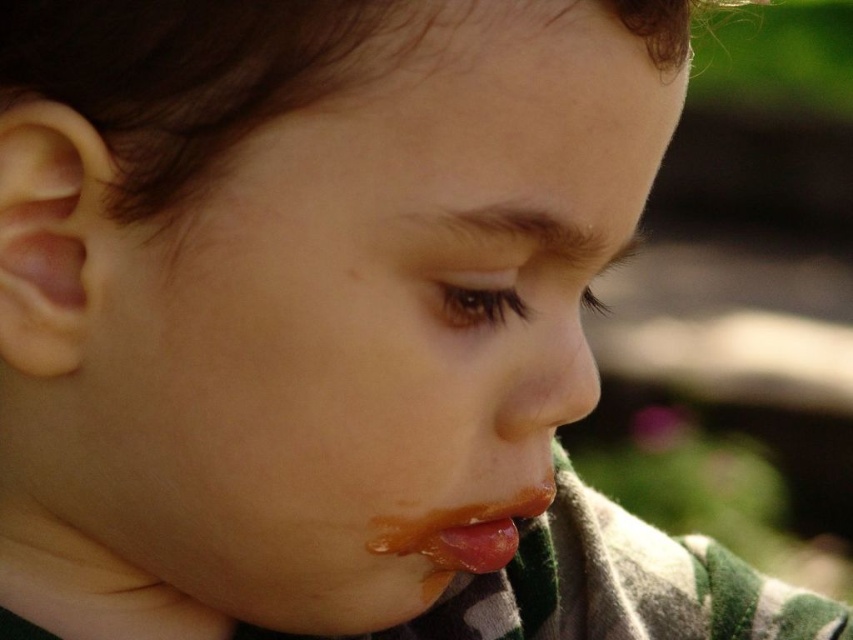
Looking at the child in the image, which object has a larger height between the smooth skin face at center and the glossy orange lips at lower center?

The smooth skin face at center has a greater height compared to the glossy orange lips at lower center.

Looking at this image, based on the scene description, can you determine the spatial relationship between the smooth skin face at center and the glossy orange lips at lower center?

The smooth skin face at center is positioned over the glossy orange lips at lower center.

What are the coordinates of the smooth skin face at center?

A: The smooth skin face at center is located at coordinates point (368, 310).